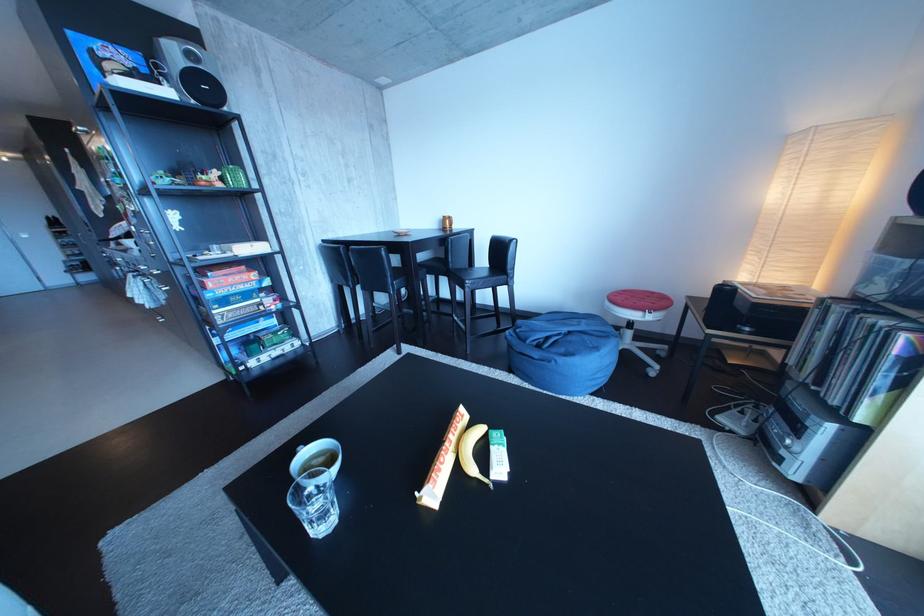
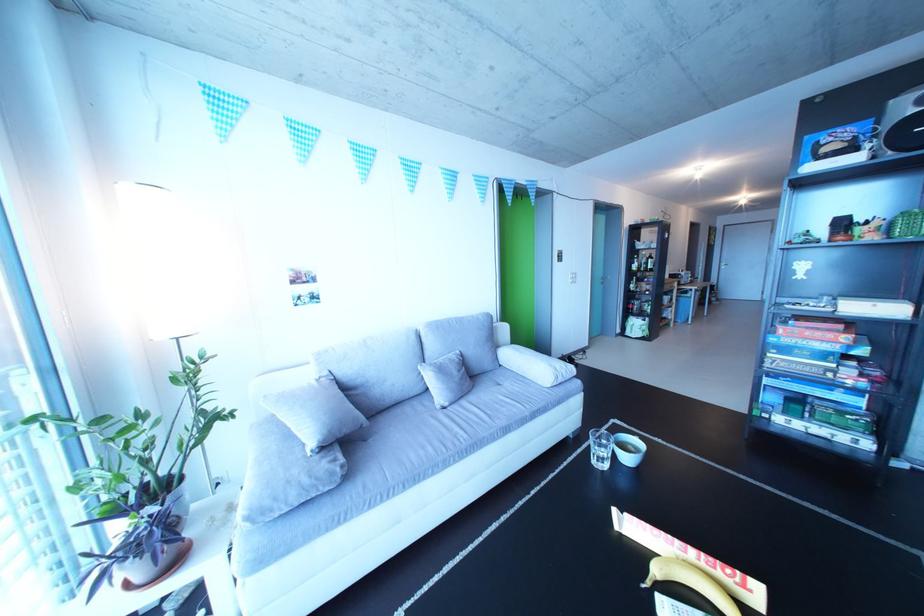
Locate, in the second image, the point that corresponds to (310,349) in the first image.

(881, 451)